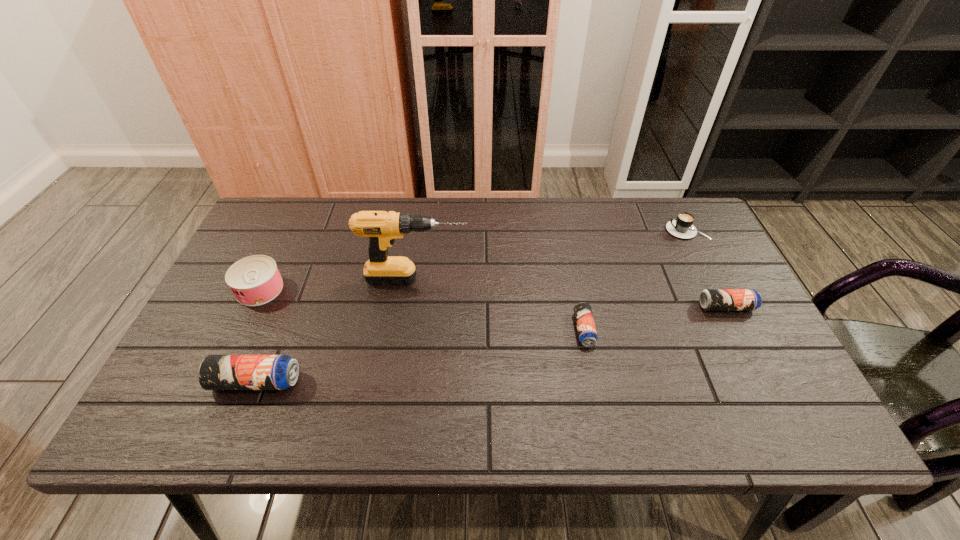
Identify the location of unoccupied area between the farthest object and the second tallest beer can. The width and height of the screenshot is (960, 540). (707, 268).

The image size is (960, 540). Find the location of `object that stands as the fifth closest to the leftmost beer can`. object that stands as the fifth closest to the leftmost beer can is located at coordinates (682, 226).

At what (x,y) coordinates should I click in order to perform the action: click on object that ranks as the closest to the second beer can from right to left. Please return your answer as a coordinate pair (x, y). Looking at the image, I should click on (382, 228).

You are a GUI agent. You are given a task and a screenshot of the screen. Output one action in this format:
    pyautogui.click(x=<x>, y=<y>)
    Task: Click on the beer can that is the second closest to the tallest object
    The width and height of the screenshot is (960, 540).
    Given the screenshot: What is the action you would take?
    pyautogui.click(x=586, y=329)

Where is `beer can that stands as the second closest to the rightmost beer can`? The height and width of the screenshot is (540, 960). beer can that stands as the second closest to the rightmost beer can is located at coordinates (216, 372).

Where is `vacant area in the image that satisfies the following two spatial constraints: 1. on the back side of the nearest object; 2. on the left side of the second beer can from left to right`? The width and height of the screenshot is (960, 540). vacant area in the image that satisfies the following two spatial constraints: 1. on the back side of the nearest object; 2. on the left side of the second beer can from left to right is located at coordinates (276, 329).

This screenshot has height=540, width=960. Find the location of `blank space that satisfies the following two spatial constraints: 1. on the back side of the shortest beer can; 2. at the tip of the fourth object from right to left`. blank space that satisfies the following two spatial constraints: 1. on the back side of the shortest beer can; 2. at the tip of the fourth object from right to left is located at coordinates (573, 279).

This screenshot has width=960, height=540. I want to click on blank area in the image that satisfies the following two spatial constraints: 1. at the tip of the tallest object; 2. on the left side of the second shortest beer can, so click(413, 307).

Locate an element on the screen. This screenshot has height=540, width=960. vacant space that satisfies the following two spatial constraints: 1. at the tip of the tallest object; 2. on the right side of the second shortest beer can is located at coordinates (413, 307).